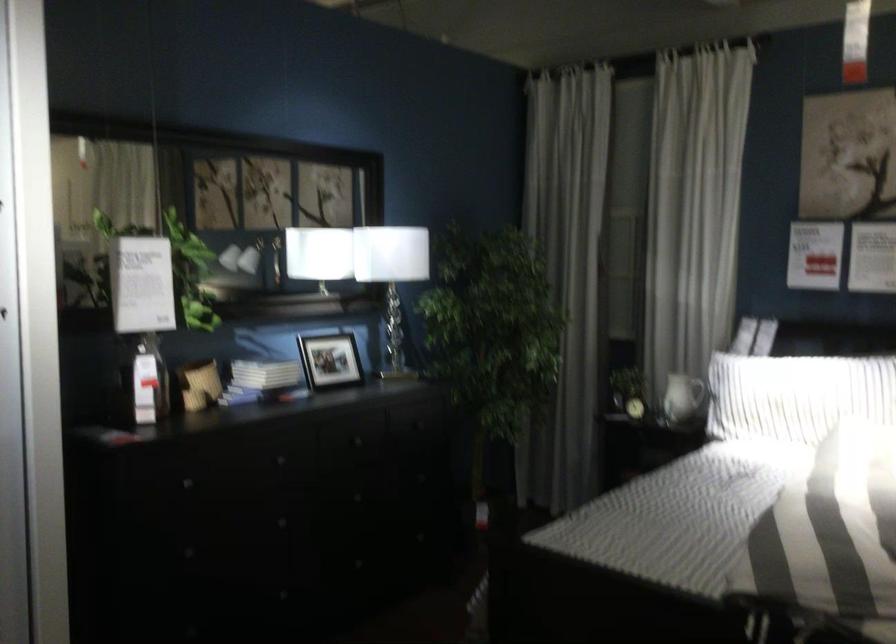
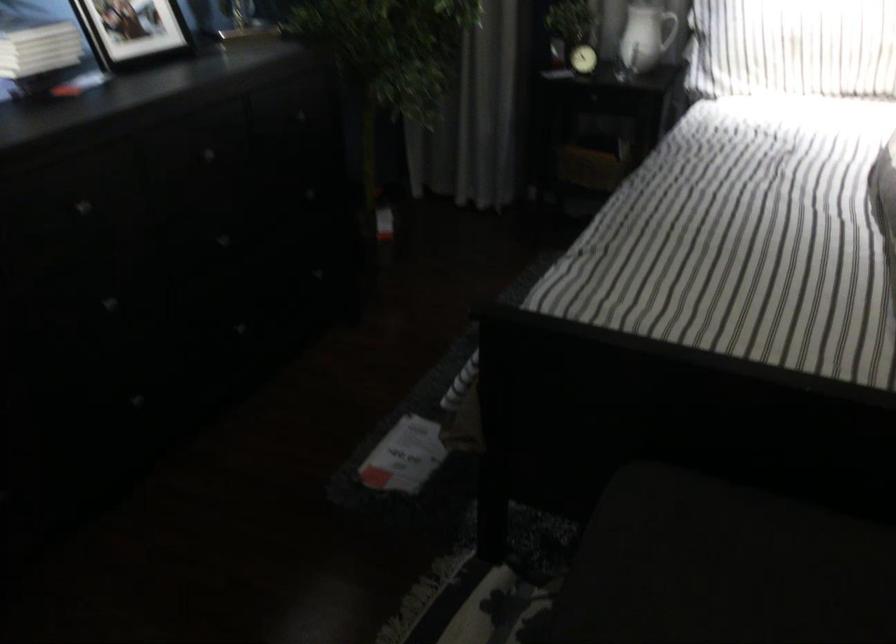
Question: Which direction would the cameraman need to move to produce the second image? Reply with the corresponding letter.

Choices:
 (A) Left
 (B) Right
 (C) Forward
 (D) Backward

Answer: (C)